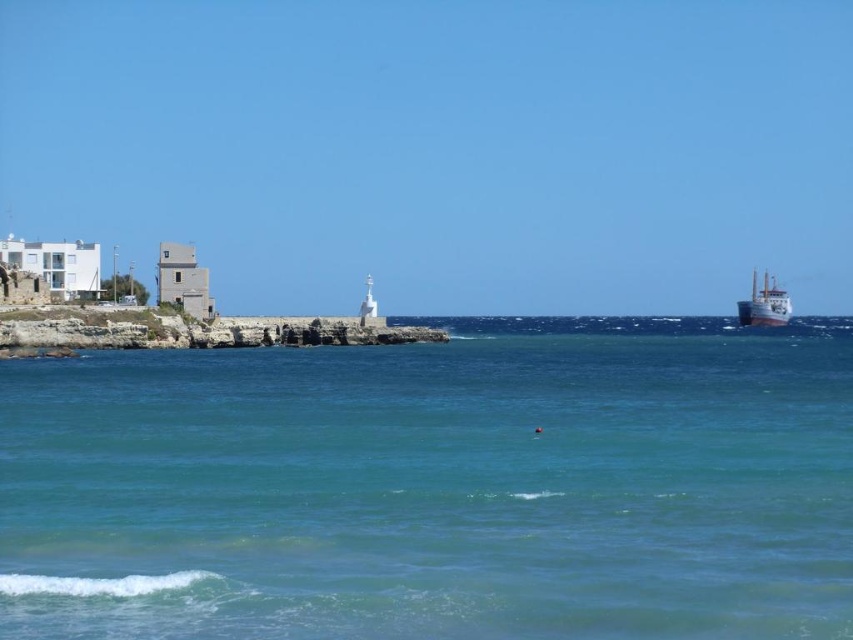
You are a photographer planning to capture the entire view of the clear blue water at center and the metallic gray ship at right in one shot. Based on their positions, do you think you can fit both into your camera frame without moving your position?

The clear blue water at center might be wider than metallic gray ship at right, so it is possible that both can be captured in one frame as the water spans a larger area, potentially encompassing the ship within the same view.

You are a sailor on the metallic gray ship at right and you want to know where the clear blue water at center is located relative to your ship. Can you tell me?

The clear blue water at center is positioned under the metallic gray ship at right, so it is directly below the ship.

You are a photographer planning to capture the clear blue water at center and the metallic gray ship at right in a single shot. Based on their positions, which object will appear larger in the photo?

The metallic gray ship at right will appear larger in the photo because it is taller than the clear blue water at center.